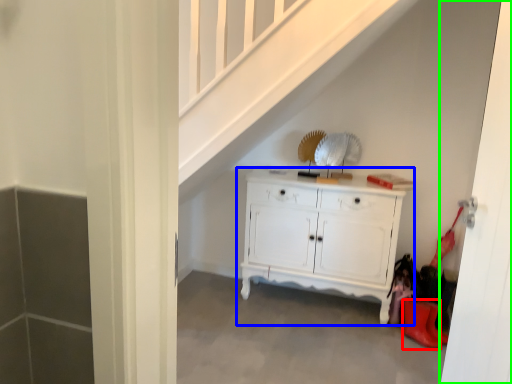
Question: Which object is the farthest from shoe (highlighted by a red box)? Choose among these: chest of drawers (highlighted by a blue box) or door (highlighted by a green box).

Choices:
 (A) chest of drawers
 (B) door

Answer: (B)